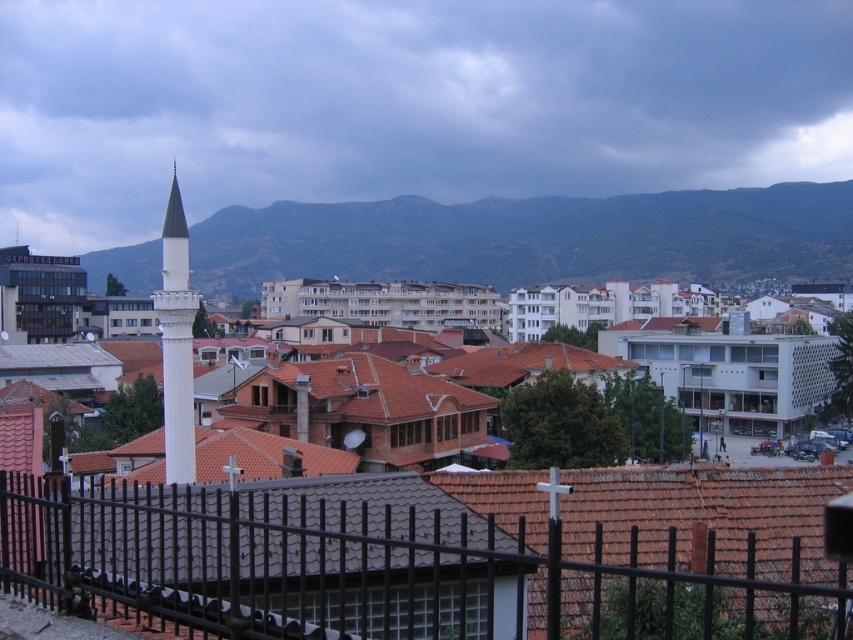
You are standing at the base of the green textured mountain at upper center and want to walk to the black metal fence at lower center. Which direction should you head to reach the fence?

The black metal fence at lower center is positioned on the left side of green textured mountain at upper center, so you should head to the left to reach the fence.

You are standing at the base of the minaret in the cityscape image. You need to locate the black metal fence at lower center. According to the coordinates provided, where exactly is it positioned?

The black metal fence at lower center is located at point coordinates of (404, 554).